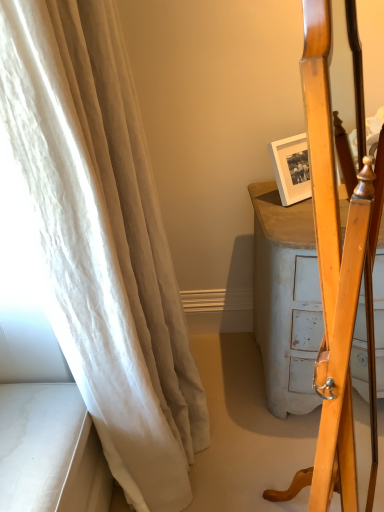
Question: Which is correct: white sheer curtain at left is inside wooden mirror at right, or outside of it?

Choices:
 (A) outside
 (B) inside

Answer: (A)

Question: Is white sheer curtain at left in front of or behind wooden mirror at right in the image?

Choices:
 (A) behind
 (B) front

Answer: (A)

Question: From a real-world perspective, relative to wooden mirror at right, is white sheer curtain at left vertically above or below?

Choices:
 (A) above
 (B) below

Answer: (A)

Question: Is wooden mirror at right bigger or smaller than white sheer curtain at left?

Choices:
 (A) big
 (B) small

Answer: (B)

Question: In terms of height, does wooden mirror at right look taller or shorter compared to white sheer curtain at left?

Choices:
 (A) short
 (B) tall

Answer: (A)

Question: In the image, is wooden mirror at right on the left side or the right side of white sheer curtain at left?

Choices:
 (A) right
 (B) left

Answer: (A)

Question: From the image's perspective, is wooden mirror at right above or below white sheer curtain at left?

Choices:
 (A) above
 (B) below

Answer: (B)